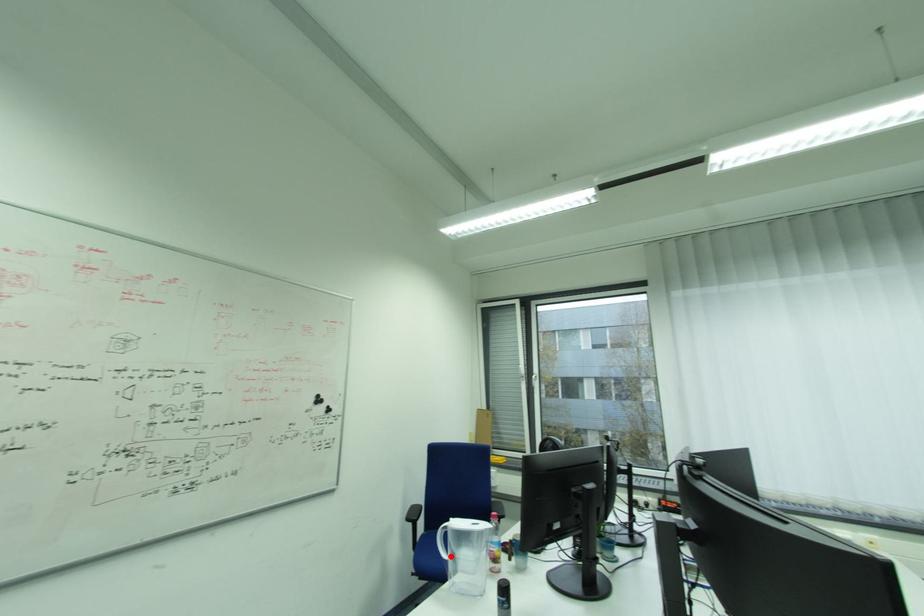
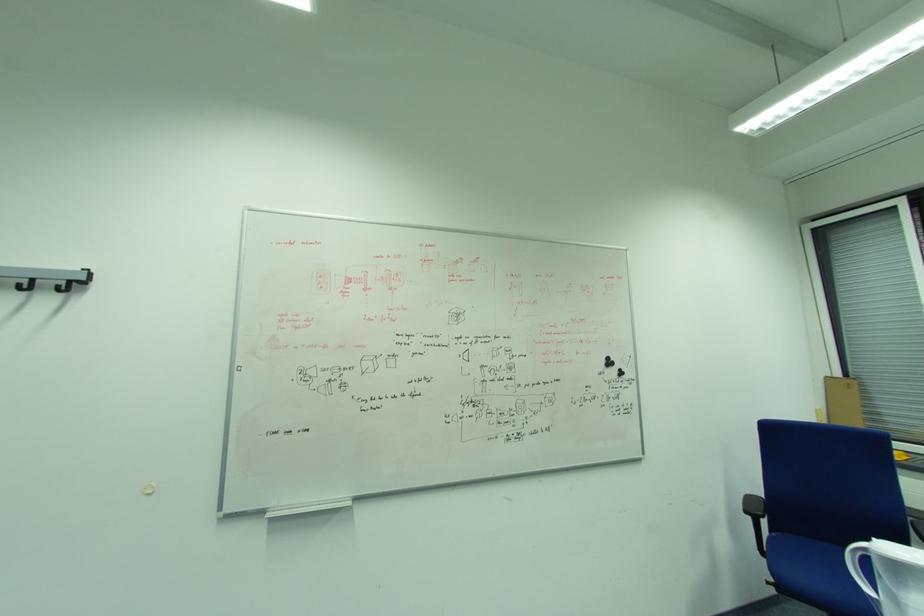
Question: A red point is marked in image1. In image2, is the corresponding 3D point closer to the camera or farther? Reply with the corresponding letter.

Choices:
 (A) The corresponding 3D point is closer.
 (B) The corresponding 3D point is farther.

Answer: (A)